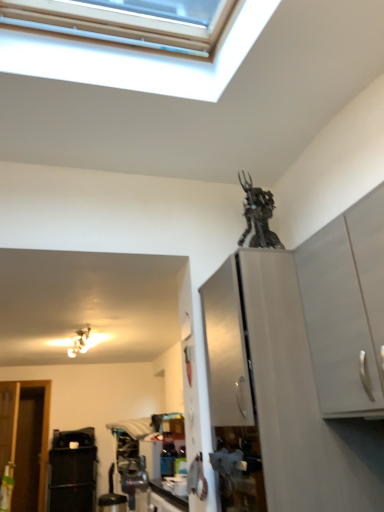
Question: Does white matte cabinet at upper right, which is the 2th cabinetry in back-to-front order, have a lesser width compared to black plastic trash can at lower left?

Choices:
 (A) yes
 (B) no

Answer: (A)

Question: From a real-world perspective, is white matte cabinet at upper right, which is the 2th cabinetry in back-to-front order, positioned under black plastic trash can at lower left based on gravity?

Choices:
 (A) yes
 (B) no

Answer: (B)

Question: Does white matte cabinet at upper right, arranged as the 1th cabinetry when viewed from the front, have a smaller size compared to black plastic trash can at lower left?

Choices:
 (A) yes
 (B) no

Answer: (A)

Question: Considering the relative sizes of white matte cabinet at upper right, arranged as the 1th cabinetry when viewed from the front, and black plastic trash can at lower left in the image provided, is white matte cabinet at upper right, arranged as the 1th cabinetry when viewed from the front, bigger than black plastic trash can at lower left?

Choices:
 (A) yes
 (B) no

Answer: (B)

Question: From the image's perspective, does white matte cabinet at upper right, arranged as the 1th cabinetry when viewed from the front, appear lower than black plastic trash can at lower left?

Choices:
 (A) yes
 (B) no

Answer: (B)

Question: Considering the positions of satin white cabinet at upper right, the second cabinetry positioned from the front, and metallic statue at upper center in the image, is satin white cabinet at upper right, the second cabinetry positioned from the front, wider or thinner than metallic statue at upper center?

Choices:
 (A) thin
 (B) wide

Answer: (B)

Question: From their relative heights in the image, would you say satin white cabinet at upper right, marked as the first cabinetry in a back-to-front arrangement, is taller or shorter than metallic statue at upper center?

Choices:
 (A) tall
 (B) short

Answer: (A)

Question: Based on their sizes in the image, would you say satin white cabinet at upper right, the second cabinetry positioned from the front, is bigger or smaller than metallic statue at upper center?

Choices:
 (A) big
 (B) small

Answer: (A)

Question: Is point (355, 481) positioned closer to the camera than point (276, 240)?

Choices:
 (A) farther
 (B) closer

Answer: (B)

Question: From the image's perspective, is white matte cabinet at upper right, arranged as the 1th cabinetry when viewed from the front, positioned above or below metallic statue at upper center?

Choices:
 (A) below
 (B) above

Answer: (A)

Question: Considering the positions of white matte cabinet at upper right, which is the 2th cabinetry in back-to-front order, and metallic statue at upper center in the image, is white matte cabinet at upper right, which is the 2th cabinetry in back-to-front order, bigger or smaller than metallic statue at upper center?

Choices:
 (A) small
 (B) big

Answer: (B)

Question: Relative to metallic statue at upper center, is white matte cabinet at upper right, which is the 2th cabinetry in back-to-front order, in front or behind?

Choices:
 (A) front
 (B) behind

Answer: (A)

Question: Considering the positions of white matte cabinet at upper right, which is the 2th cabinetry in back-to-front order, and metallic statue at upper center in the image, is white matte cabinet at upper right, which is the 2th cabinetry in back-to-front order, taller or shorter than metallic statue at upper center?

Choices:
 (A) tall
 (B) short

Answer: (A)

Question: From the image's perspective, relative to metallic statue at upper center, is metallic silver light fixture at upper left above or below?

Choices:
 (A) above
 (B) below

Answer: (B)

Question: Considering the positions of metallic silver light fixture at upper left and metallic statue at upper center in the image, is metallic silver light fixture at upper left bigger or smaller than metallic statue at upper center?

Choices:
 (A) small
 (B) big

Answer: (A)